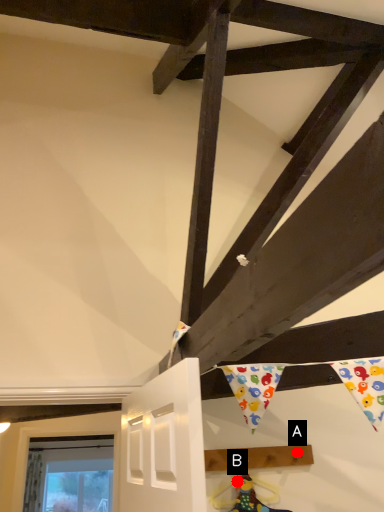
Question: Two points are circled on the image, labeled by A and B beside each circle. Among these points, which one is farthest from the camera?

Choices:
 (A) A is further
 (B) B is further

Answer: (A)